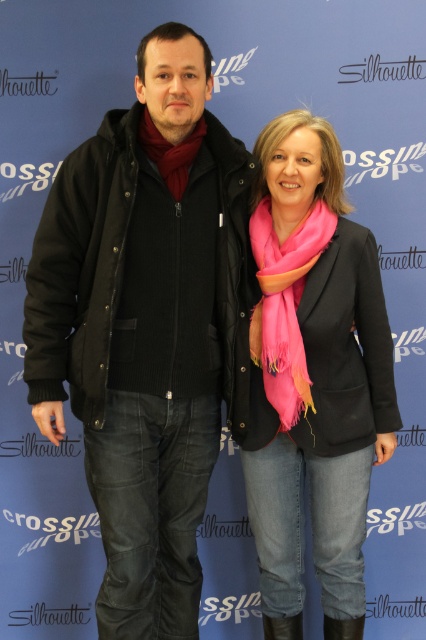
You are a photographer setting up a shoot with two models. The scene includes a black cotton jacket at left. Where exactly should you position your camera to capture the jacket in the frame?

The black cotton jacket at left is located at point (138, 333), so you should position your camera to focus on that coordinate to capture the jacket in the frame.

You are organizing a fashion show and need to decide which scarf to feature based on size. Given the pink soft scarf at center and the matte red scarf at center, which one should you choose if you want the larger scarf for the runway?

The pink soft scarf at center is bigger than the matte red scarf at center, so you should choose the pink soft scarf at center for the runway as it is larger.

You are an interior designer who needs to choose between two scarves for a display. The scene shows a man and a woman standing against a blue backdrop. The woman has a pink scarf at center and a pink soft scarf at center. Which scarf is taller?

The pink scarf at center is much taller than the pink soft scarf at center according to the description.